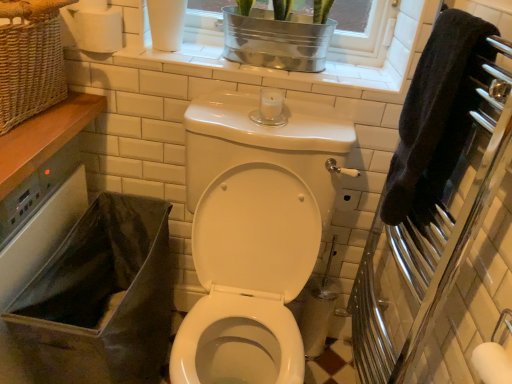
Question: Does metallic silver window frame at upper center, arranged as the 1th window frame when viewed from the right, have a smaller size compared to black terry cloth towel at right?

Choices:
 (A) yes
 (B) no

Answer: (B)

Question: Does metallic silver window frame at upper center, marked as the second window frame in a left-to-right arrangement, have a greater width compared to black terry cloth towel at right?

Choices:
 (A) no
 (B) yes

Answer: (B)

Question: Considering the relative positions of metallic silver window frame at upper center, arranged as the 1th window frame when viewed from the right, and black terry cloth towel at right in the image provided, is metallic silver window frame at upper center, arranged as the 1th window frame when viewed from the right, to the left of black terry cloth towel at right from the viewer's perspective?

Choices:
 (A) yes
 (B) no

Answer: (A)

Question: From a real-world perspective, is metallic silver window frame at upper center, arranged as the 1th window frame when viewed from the right, beneath black terry cloth towel at right?

Choices:
 (A) no
 (B) yes

Answer: (A)

Question: Is black terry cloth towel at right located within metallic silver window frame at upper center, marked as the second window frame in a left-to-right arrangement?

Choices:
 (A) no
 (B) yes

Answer: (A)

Question: From their relative heights in the image, would you say white matte toilet paper at upper left is taller or shorter than woven wicker basket at upper left?

Choices:
 (A) tall
 (B) short

Answer: (B)

Question: Looking at their shapes, would you say white matte toilet paper at upper left is wider or thinner than woven wicker basket at upper left?

Choices:
 (A) thin
 (B) wide

Answer: (A)

Question: Considering the relative positions of white matte toilet paper at upper left and woven wicker basket at upper left in the image provided, is white matte toilet paper at upper left to the left or to the right of woven wicker basket at upper left?

Choices:
 (A) left
 (B) right

Answer: (B)

Question: Would you say white matte toilet paper at upper left is inside or outside woven wicker basket at upper left?

Choices:
 (A) inside
 (B) outside

Answer: (B)

Question: Is black fabric laundry basket at lower left inside the boundaries of woven wicker basket at upper left, or outside?

Choices:
 (A) inside
 (B) outside

Answer: (B)

Question: From their relative heights in the image, would you say black fabric laundry basket at lower left is taller or shorter than woven wicker basket at upper left?

Choices:
 (A) short
 (B) tall

Answer: (B)

Question: Is black fabric laundry basket at lower left in front of or behind woven wicker basket at upper left in the image?

Choices:
 (A) front
 (B) behind

Answer: (B)

Question: In terms of width, does black fabric laundry basket at lower left look wider or thinner when compared to woven wicker basket at upper left?

Choices:
 (A) wide
 (B) thin

Answer: (A)

Question: From a real-world perspective, is white tile window frame at upper center, the 2th window frame from the right, physically located above or below polished chrome towel rack at right?

Choices:
 (A) above
 (B) below

Answer: (A)

Question: Considering the positions of white tile window frame at upper center, the first window frame when ordered from left to right, and polished chrome towel rack at right in the image, is white tile window frame at upper center, the first window frame when ordered from left to right, bigger or smaller than polished chrome towel rack at right?

Choices:
 (A) big
 (B) small

Answer: (B)